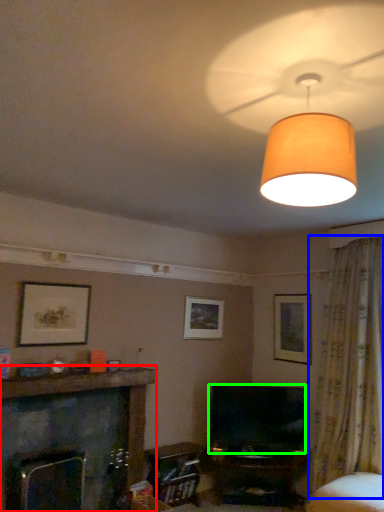
Question: Estimate the real-world distances between objects in this image. Which object is closer to fireplace (highlighted by a red box), curtain (highlighted by a blue box) or television (highlighted by a green box)?

Choices:
 (A) curtain
 (B) television

Answer: (B)